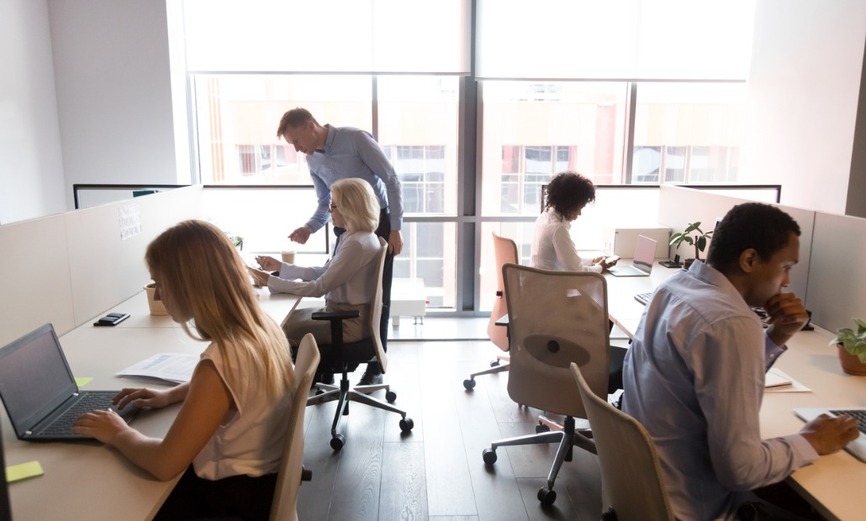
This screenshot has height=521, width=866. I want to click on chairs, so click(x=547, y=345), click(x=595, y=418), click(x=505, y=253), click(x=385, y=292), click(x=302, y=434).